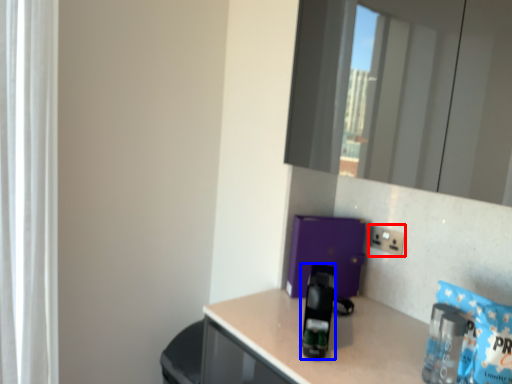
Question: Which object appears farthest to the camera in this image, electric outlet (highlighted by a red box) or appliance (highlighted by a blue box)?

Choices:
 (A) electric outlet
 (B) appliance

Answer: (A)